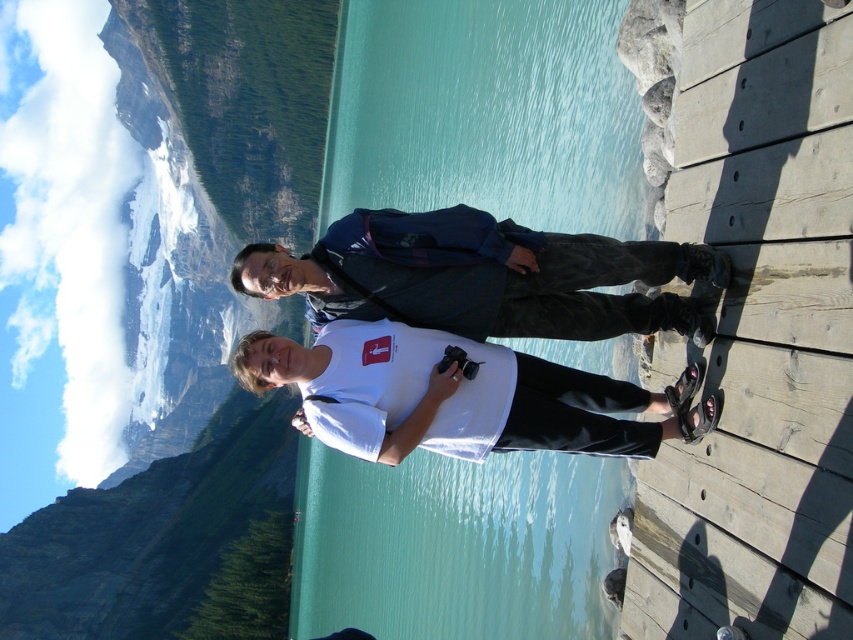
Question: Which of the following is the farthest from the observer?

Choices:
 (A) turquoise water at center
 (B) white matte shirt at center

Answer: (A)

Question: Does turquoise water at center appear on the right side of dark blue jacket at center?

Choices:
 (A) yes
 (B) no

Answer: (B)

Question: Which point is closer to the camera?

Choices:
 (A) (428, 369)
 (B) (518, 316)
 (C) (412, 584)

Answer: (A)

Question: Is dark blue jacket at center closer to camera compared to white matte shirt at center?

Choices:
 (A) no
 (B) yes

Answer: (A)

Question: Which point is closer to the camera?

Choices:
 (A) (402, 426)
 (B) (564, 304)

Answer: (A)

Question: Observing the image, what is the correct spatial positioning of dark blue jacket at center in reference to white matte shirt at center?

Choices:
 (A) below
 (B) above

Answer: (B)